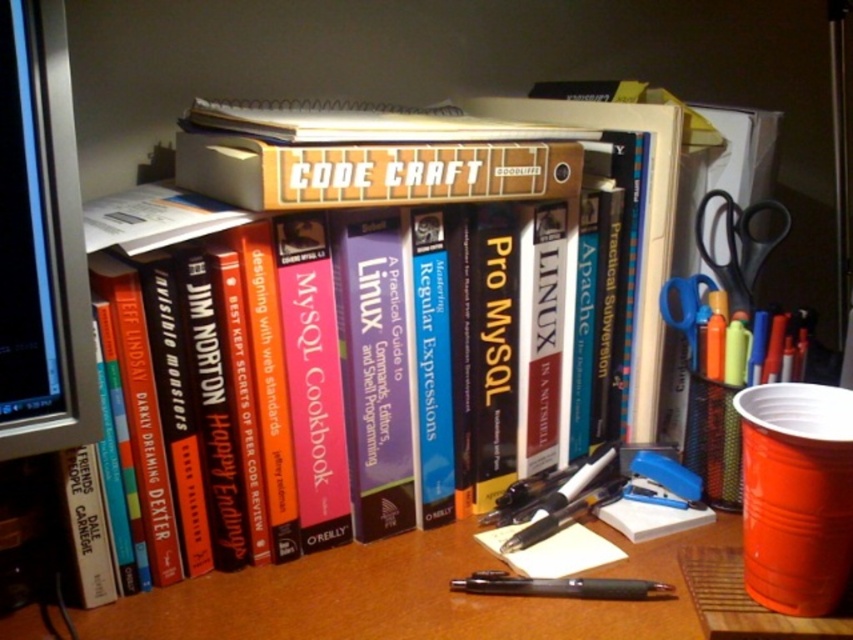
You are organizing your desk and need to place a new pair of scissors between the black plastic scissors at right and the blue plastic scissors at right. Can you fit them in the space between these two scissors?

The black plastic scissors at right are to the right of the blue plastic scissors at right, so there is no space between them. You cannot fit the new scissors between them.

You are organizing your workspace and need to move a new laptop from the left side of the matte black monitor at left to the brown wooden table at center. Which direction should you move the laptop to place it on the table?

You should move the laptop to the right since the brown wooden table at center is located to the right of the matte black monitor at left.

You are organizing your desk and need to choose between the black plastic scissors at right and the blue plastic scissors at right for cutting thick paper. Which scissors would be more suitable based on their sizes?

The black plastic scissors at right is larger than the blue plastic scissors at right, so it would be more suitable for cutting thick paper due to its increased size and potential strength.